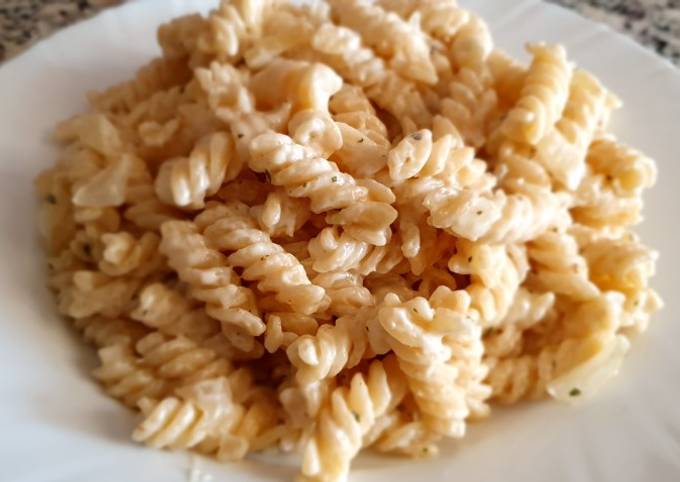
Locate an element on the screen. bowl is located at coordinates (653, 429).